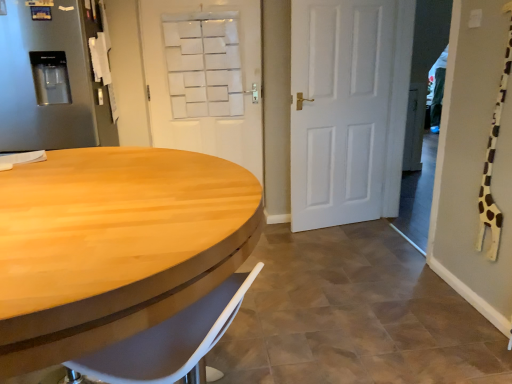
Locate an element on the screen. This screenshot has height=384, width=512. vacant space in front of white matte door at center, placed as the second door when sorted from left to right is located at coordinates (324, 250).